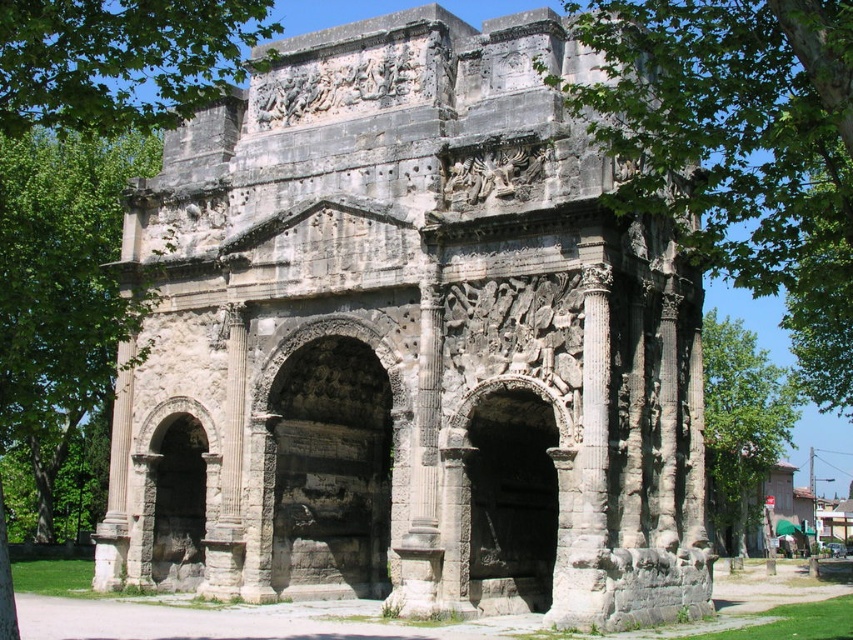
Which is above, rough stone archway at center or rustic stone archway at center?

rough stone archway at center

Can you confirm if rough stone archway at center is taller than rustic stone archway at center?

Yes.

Is point (498, 561) farther from viewer compared to point (149, 570)?

No.

Identify the location of rough stone archway at center. [x=502, y=502].

Who is more forward, (755, 232) or (68, 202)?

Point (755, 232)

This screenshot has height=640, width=853. What do you see at coordinates (738, 148) in the screenshot?
I see `green leafy tree at upper right` at bounding box center [738, 148].

Which is behind, point (825, 244) or point (30, 413)?

Positioned behind is point (30, 413).

At what (x,y) coordinates should I click in order to perform the action: click on green leafy tree at upper right. Please return your answer as a coordinate pair (x, y). The height and width of the screenshot is (640, 853). Looking at the image, I should click on (738, 148).

Between gray stone arch at center and gray stone archway at center, which one is positioned higher?

Positioned higher is gray stone arch at center.

Does point (682, 284) come closer to viewer compared to point (281, 582)?

Yes.

Between point (366, 540) and point (260, 596), which one is positioned behind?

Point (366, 540)

The image size is (853, 640). Find the location of `gray stone arch at center`. gray stone arch at center is located at coordinates (421, 339).